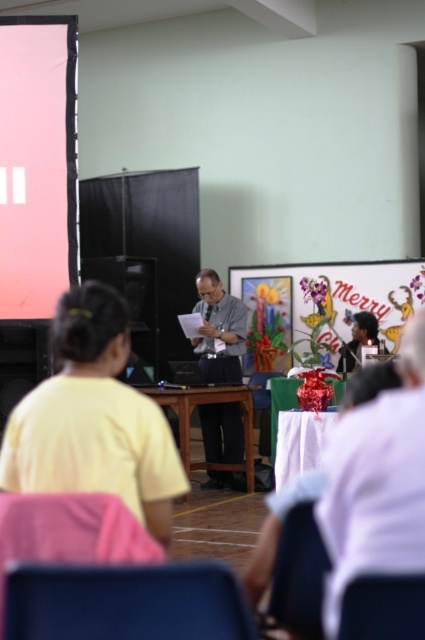
Is point (367, 625) in front of point (339, 397)?

Yes, point (367, 625) is closer to viewer.

Can you confirm if smooth plastic chair at lower center is positioned to the left of white cloth-covered table at center?

Indeed, smooth plastic chair at lower center is positioned on the left side of white cloth-covered table at center.

Between point (356, 600) and point (280, 381), which one is positioned behind?

The point (280, 381) is more distant.

Where is `smooth plastic chair at lower center`? The height and width of the screenshot is (640, 425). smooth plastic chair at lower center is located at coordinates [384, 609].

Can you confirm if smooth plastic chair at lower center is thinner than matte black hair at center?

Yes.

Describe the element at coordinates (384, 609) in the screenshot. I see `smooth plastic chair at lower center` at that location.

What are the coordinates of `smooth plastic chair at lower center` in the screenshot? It's located at (384, 609).

Is smooth plastic chair at lower center positioned in front of white fabric table at center?

Yes, smooth plastic chair at lower center is in front of white fabric table at center.

Is smooth plastic chair at lower center thinner than white fabric table at center?

Correct, smooth plastic chair at lower center's width is less than white fabric table at center's.

Between point (385, 634) and point (300, 472), which one is positioned in front?

Point (385, 634) is more forward.

Identify the location of smooth plastic chair at lower center. This screenshot has height=640, width=425. (384, 609).